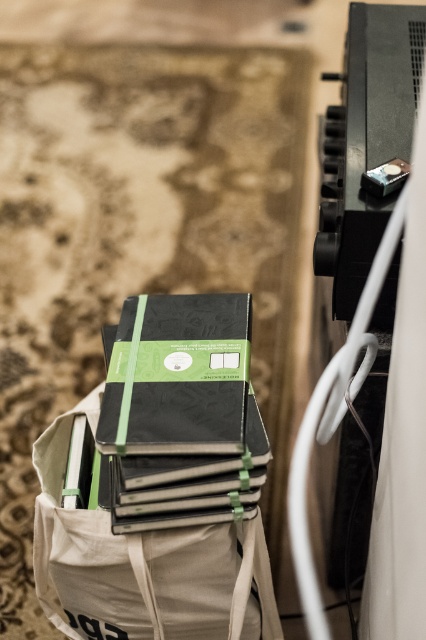
Question: Among these objects, which one is nearest to the camera?

Choices:
 (A) matte black notebook at center
 (B) canvas tote bag at center

Answer: (A)

Question: Is canvas tote bag at center further to the viewer compared to matte black notebook at center?

Choices:
 (A) no
 (B) yes

Answer: (B)

Question: Among these objects, which one is farthest from the camera?

Choices:
 (A) canvas tote bag at center
 (B) matte black notebook at center

Answer: (A)

Question: Is canvas tote bag at center bigger than matte black notebook at center?

Choices:
 (A) yes
 (B) no

Answer: (A)

Question: Does canvas tote bag at center have a larger size compared to matte black notebook at center?

Choices:
 (A) no
 (B) yes

Answer: (B)